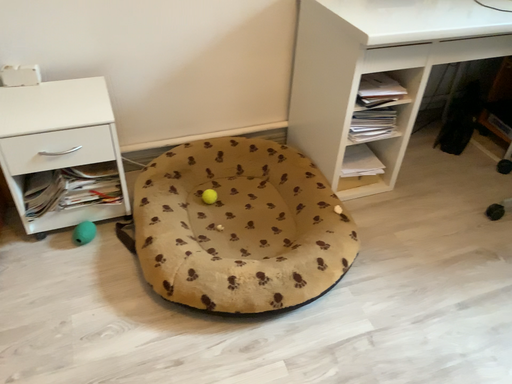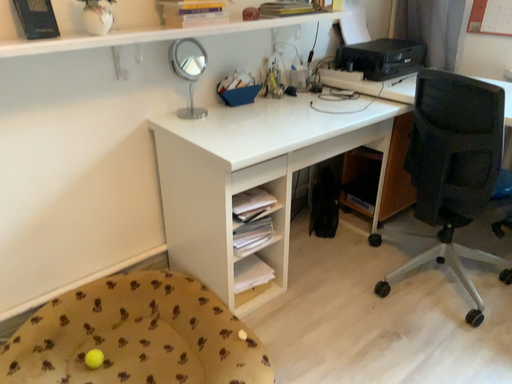
Question: Which way did the camera rotate in the video?

Choices:
 (A) rotated left
 (B) rotated right

Answer: (B)